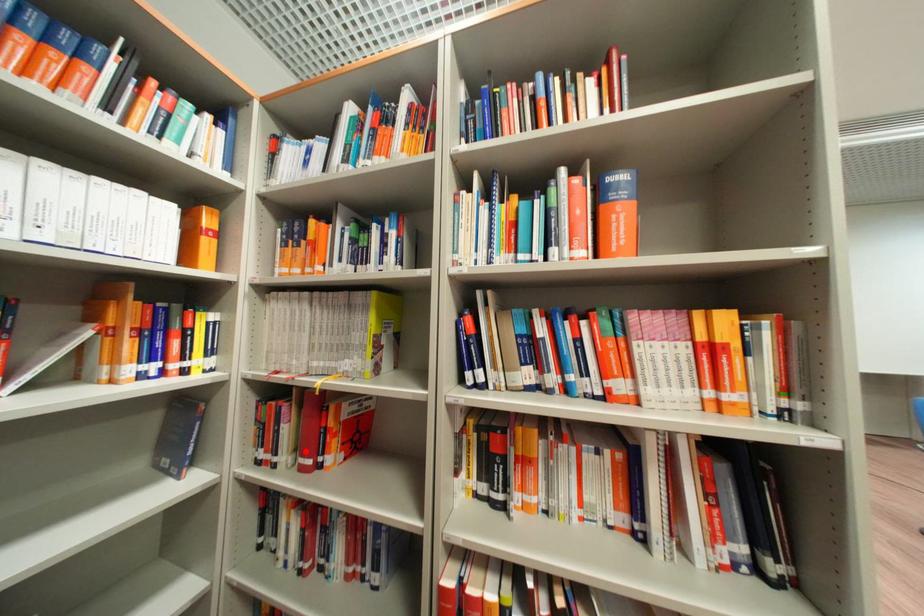
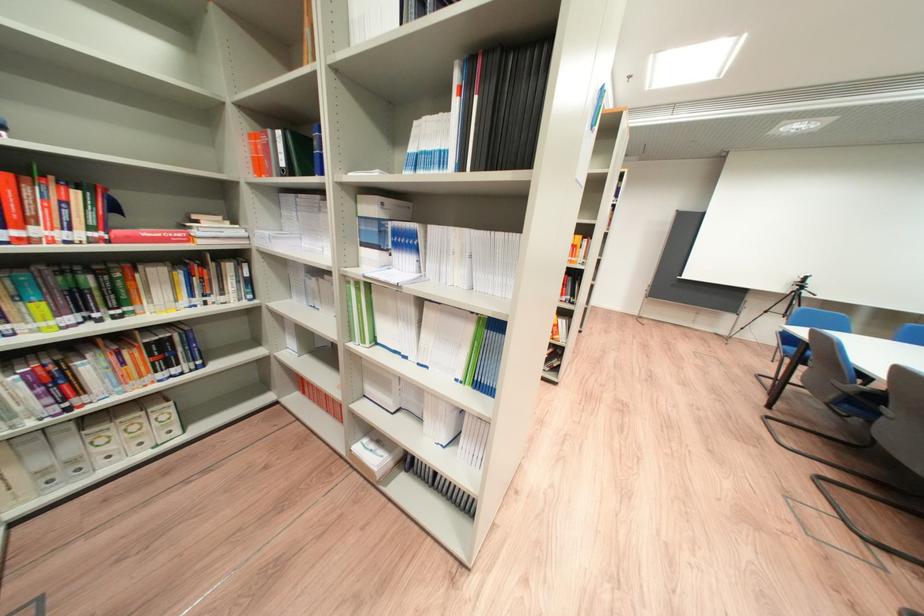
Question: I am providing you with two images of the same scene from different viewpoints. A red point is marked on the first image. Is the red point's position out of view in image 2?

Choices:
 (A) Yes
 (B) No

Answer: (A)